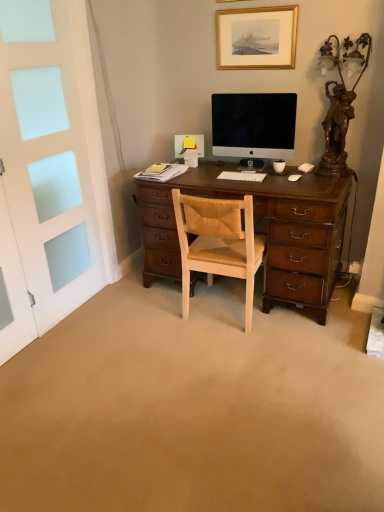
What do you see at coordinates (53, 154) in the screenshot?
I see `white frosted glass screen door at left` at bounding box center [53, 154].

Measure the distance between gold-framed picture at upper center and camera.

gold-framed picture at upper center and camera are 2.40 meters apart from each other.

Measure the distance between point (272, 28) and camera.

Point (272, 28) is 2.49 meters away from camera.

This screenshot has height=512, width=384. Find the location of `satin black monitor at center`. satin black monitor at center is located at coordinates (254, 125).

Locate an element on the screen. The image size is (384, 512). white plastic keyboard at center is located at coordinates (242, 176).

Image resolution: width=384 pixels, height=512 pixels. What do you see at coordinates (340, 101) in the screenshot? I see `bronze statue at right` at bounding box center [340, 101].

I want to click on white matte computer mouse at right, arranged as the second computer mouse when viewed from the front, so click(306, 167).

What do you see at coordinates (306, 167) in the screenshot? I see `white matte computer mouse at right, arranged as the 1th computer mouse when viewed from the top` at bounding box center [306, 167].

The width and height of the screenshot is (384, 512). I want to click on white matte computer mouse at center-right, the 1th computer mouse in the bottom-to-top sequence, so click(x=294, y=177).

The height and width of the screenshot is (512, 384). What are the coordinates of `white frosted glass screen door at left` in the screenshot? It's located at point(53,154).

What's the angular difference between light brown leather chair at center and gold-framed picture at upper center's facing directions?

They differ by 179 degrees in their facing directions.

From the image's perspective, is light brown leather chair at center located beneath gold-framed picture at upper center?

Yes, from the image's perspective, light brown leather chair at center is beneath gold-framed picture at upper center.

From a real-world perspective, relative to gold-framed picture at upper center, is light brown leather chair at center vertically above or below?

light brown leather chair at center is below gold-framed picture at upper center.

Considering the sizes of objects light brown leather chair at center and gold-framed picture at upper center in the image provided, who is bigger, light brown leather chair at center or gold-framed picture at upper center?

light brown leather chair at center is bigger.

Who is taller, white frosted glass screen door at left or white matte computer mouse at right, which is the first computer mouse in right-to-left order?

white frosted glass screen door at left is taller.

Is white frosted glass screen door at left at the right side of white matte computer mouse at right, the first computer mouse viewed from the back?

No.

Consider the image. Can you tell me how much white frosted glass screen door at left and white matte computer mouse at right, which is the second computer mouse from bottom to top, differ in facing direction?

There is a 120-degree angle between the facing directions of white frosted glass screen door at left and white matte computer mouse at right, which is the second computer mouse from bottom to top.

Considering their positions, is white frosted glass screen door at left located in front of or behind white matte computer mouse at right, the 2th computer mouse when ordered from left to right?

Visually, white frosted glass screen door at left is located in front of white matte computer mouse at right, the 2th computer mouse when ordered from left to right.

Which object is positioned more to the right, white matte computer mouse at right, arranged as the 1th computer mouse when viewed from the top, or satin black monitor at center?

white matte computer mouse at right, arranged as the 1th computer mouse when viewed from the top.

From a real-world perspective, is white matte computer mouse at right, the 2th computer mouse when ordered from left to right, above or below satin black monitor at center?

white matte computer mouse at right, the 2th computer mouse when ordered from left to right, is below satin black monitor at center.

Does point (304, 163) come in front of point (277, 108)?

No, (304, 163) is behind (277, 108).

Which is behind, satin black monitor at center or white plastic keyboard at center?

white plastic keyboard at center is further away from the camera.

From the picture: Is satin black monitor at center aimed at white plastic keyboard at center?

Yes, satin black monitor at center faces towards white plastic keyboard at center.

Which is nearer, (x=288, y=128) or (x=259, y=181)?

Point (x=288, y=128) appears to be farther away from the viewer than point (x=259, y=181).

Is white plastic keyboard at center inside satin black monitor at center?

Actually, white plastic keyboard at center is outside satin black monitor at center.

From a real-world perspective, between white plastic keyboard at center and light brown leather chair at center, who is vertically lower?

From a 3D spatial view, light brown leather chair at center is below.

Is white plastic keyboard at center shorter than light brown leather chair at center?

Correct, white plastic keyboard at center is not as tall as light brown leather chair at center.

Considering the sizes of objects white plastic keyboard at center and light brown leather chair at center in the image provided, who is bigger, white plastic keyboard at center or light brown leather chair at center?

Bigger between the two is light brown leather chair at center.

Is white plastic keyboard at center positioned with its back to light brown leather chair at center?

No, light brown leather chair at center is not at the back of white plastic keyboard at center.

Is gold-framed picture at upper center positioned with its back to white matte computer mouse at center-right, the second computer mouse when ordered from top to bottom?

gold-framed picture at upper center does not have its back to white matte computer mouse at center-right, the second computer mouse when ordered from top to bottom.

Would you say gold-framed picture at upper center is inside or outside white matte computer mouse at center-right, which is counted as the second computer mouse, starting from the right?

A: gold-framed picture at upper center cannot be found inside white matte computer mouse at center-right, which is counted as the second computer mouse, starting from the right.

At what (x,y) coordinates should I click in order to perform the action: click on computer mouse that is the 2nd one below the gold-framed picture at upper center (from a real-world perspective). Please return your answer as a coordinate pair (x, y). Image resolution: width=384 pixels, height=512 pixels. Looking at the image, I should click on (294, 177).

Is point (289, 40) farther from camera compared to point (290, 177)?

Yes, it is.

Who is shorter, white matte computer mouse at right, arranged as the second computer mouse when viewed from the front, or gold-framed picture at upper center?

Standing shorter between the two is white matte computer mouse at right, arranged as the second computer mouse when viewed from the front.

Which of these two, white matte computer mouse at right, which is the second computer mouse from bottom to top, or gold-framed picture at upper center, is bigger?

Bigger between the two is gold-framed picture at upper center.

Identify the location of picture frame above the white matte computer mouse at right, which is the second computer mouse from bottom to top (from a real-world perspective). (256, 38).

Is white matte computer mouse at right, the first computer mouse viewed from the back, oriented towards gold-framed picture at upper center?

No.

Where is `chair that appears on the left of gold-framed picture at upper center`? The width and height of the screenshot is (384, 512). chair that appears on the left of gold-framed picture at upper center is located at coordinates (218, 243).

Where is `screen door in front of the white matte computer mouse at right, the first computer mouse viewed from the back`? screen door in front of the white matte computer mouse at right, the first computer mouse viewed from the back is located at coordinates (53, 154).

Estimate the real-world distances between objects in this image. Which object is closer to white matte computer mouse at center-right, the 1th computer mouse in the bottom-to-top sequence, light brown leather chair at center or bronze statue at right?

Among the two, bronze statue at right is located nearer to white matte computer mouse at center-right, the 1th computer mouse in the bottom-to-top sequence.

Based on their spatial positions, is light brown leather chair at center or white plastic keyboard at center further from gold-framed picture at upper center?

Based on the image, light brown leather chair at center appears to be further to gold-framed picture at upper center.

When comparing their distances from white matte computer mouse at right, which is the second computer mouse from bottom to top, does satin black monitor at center or light brown leather chair at center seem further?

The object further to white matte computer mouse at right, which is the second computer mouse from bottom to top, is light brown leather chair at center.

From the image, which object appears to be nearer to satin black monitor at center, white plastic keyboard at center or bronze statue at right?

The object closer to satin black monitor at center is white plastic keyboard at center.

Which object lies further to the anchor point white matte computer mouse at right, the first computer mouse viewed from the back, white frosted glass screen door at left or bronze statue at right?

Among the two, white frosted glass screen door at left is located further to white matte computer mouse at right, the first computer mouse viewed from the back.

Estimate the real-world distances between objects in this image. Which object is closer to gold-framed picture at upper center, white plastic keyboard at center or light brown leather chair at center?

Among the two, white plastic keyboard at center is located nearer to gold-framed picture at upper center.

From the image, which object appears to be nearer to satin black monitor at center, light brown leather chair at center or white frosted glass screen door at left?

light brown leather chair at center is positioned closer to the anchor satin black monitor at center.

Considering their positions, is gold-framed picture at upper center positioned further to white plastic keyboard at center than bronze statue at right?

gold-framed picture at upper center is positioned further to the anchor white plastic keyboard at center.

Where is `computer mouse between gold-framed picture at upper center and white plastic keyboard at center in the up-down direction`? The width and height of the screenshot is (384, 512). computer mouse between gold-framed picture at upper center and white plastic keyboard at center in the up-down direction is located at coordinates (306, 167).

In order to click on television situated between white plastic keyboard at center and bronze statue at right from left to right in this screenshot , I will do `click(254, 125)`.

What are the coordinates of `television between gold-framed picture at upper center and white matte computer mouse at center-right, the 1th computer mouse positioned from the left, vertically` in the screenshot? It's located at (254, 125).

You are a GUI agent. You are given a task and a screenshot of the screen. Output one action in this format:
    pyautogui.click(x=<x>, y=<y>)
    Task: Click on the television between bronze statue at right and white matte computer mouse at right, the 2th computer mouse when ordered from left to right, along the z-axis
    Image resolution: width=384 pixels, height=512 pixels.
    Given the screenshot: What is the action you would take?
    pyautogui.click(x=254, y=125)